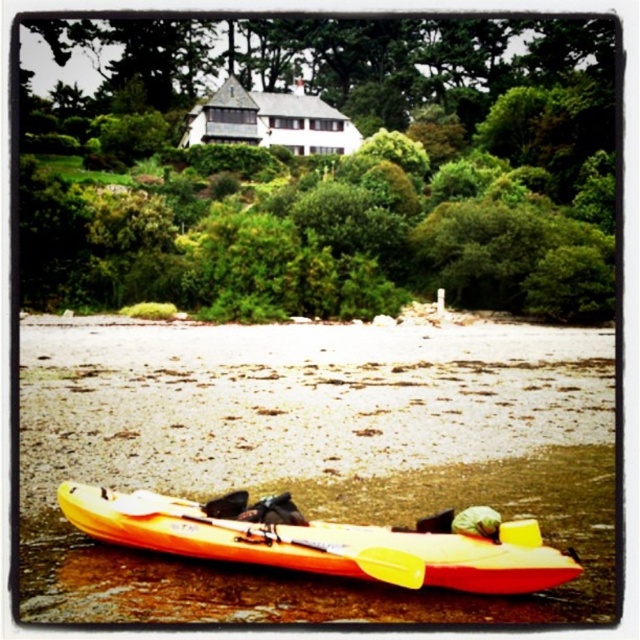
Question: Can you confirm if green leafy tree at upper center is smaller than yellow plastic paddle at lower center?

Choices:
 (A) yes
 (B) no

Answer: (B)

Question: Is green leafy tree at upper center bigger than yellow plastic paddle at lower center?

Choices:
 (A) yes
 (B) no

Answer: (A)

Question: Does green leafy tree at upper center appear on the right side of yellow matte canoe at lower center?

Choices:
 (A) yes
 (B) no

Answer: (B)

Question: Which is farther from the yellow plastic paddle at lower center?

Choices:
 (A) yellow matte canoe at lower center
 (B) green leafy tree at upper center

Answer: (B)

Question: Which of the following is the farthest from the observer?

Choices:
 (A) green leafy tree at upper center
 (B) yellow matte canoe at lower center
 (C) yellow plastic paddle at lower center

Answer: (A)

Question: Estimate the real-world distances between objects in this image. Which object is closer to the yellow matte canoe at lower center?

Choices:
 (A) green leafy tree at upper center
 (B) yellow plastic paddle at lower center

Answer: (B)